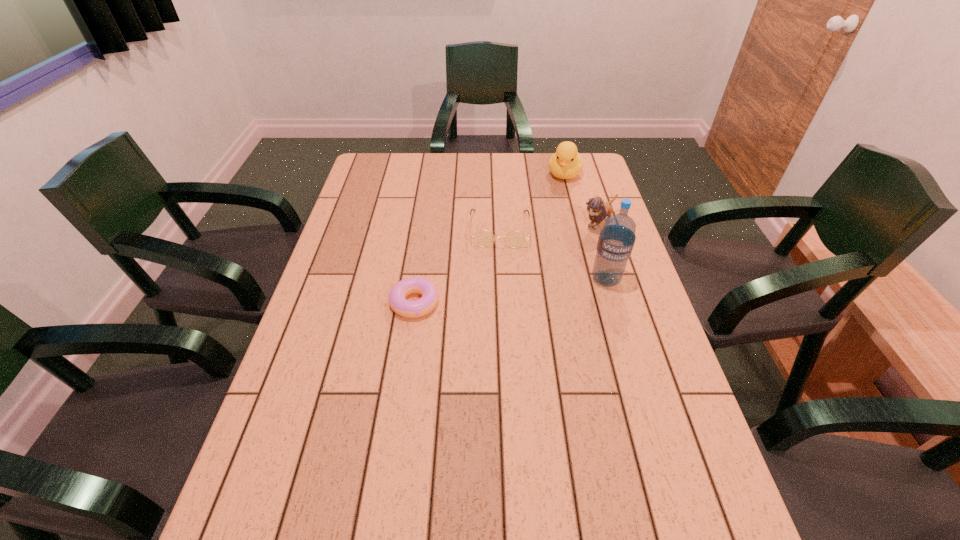
Where is `doughnut`? Image resolution: width=960 pixels, height=540 pixels. doughnut is located at coordinates (411, 309).

The width and height of the screenshot is (960, 540). I want to click on the shortest object, so click(411, 309).

At what (x,y) coordinates should I click in order to perform the action: click on water bottle. Please return your answer as a coordinate pair (x, y). The image size is (960, 540). Looking at the image, I should click on (617, 237).

Where is `duck`? This screenshot has height=540, width=960. duck is located at coordinates (566, 163).

Where is `the fourth shortest object`? The height and width of the screenshot is (540, 960). the fourth shortest object is located at coordinates (566, 163).

This screenshot has width=960, height=540. I want to click on the fourth object from right to left, so click(x=483, y=238).

Find the location of a particular element. spectacles is located at coordinates (483, 238).

I want to click on the third tallest object, so click(x=598, y=210).

At what (x,y) coordinates should I click in order to perform the action: click on vacant space positioned on the left of the shortest object. Please return your answer as a coordinate pair (x, y). The image size is (960, 540). Looking at the image, I should click on (338, 302).

This screenshot has width=960, height=540. I want to click on free space located on the front of the water bottle, so click(617, 319).